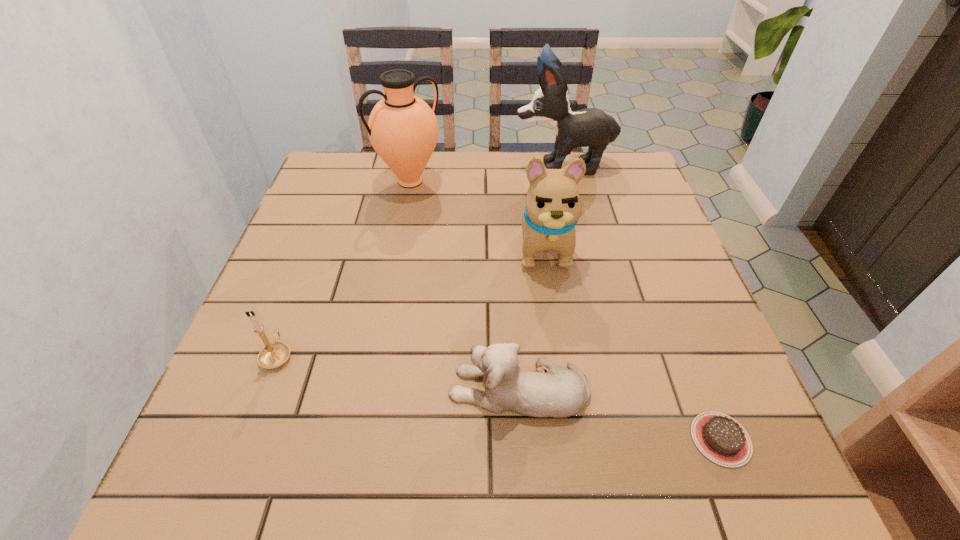
The image size is (960, 540). Identify the location of the tallest puppy. (591, 127).

The width and height of the screenshot is (960, 540). Find the location of `the second object from left to right`. the second object from left to right is located at coordinates (402, 128).

Identify the location of the second farthest puppy. This screenshot has width=960, height=540. (553, 206).

The width and height of the screenshot is (960, 540). In order to click on the second shortest puppy in this screenshot , I will do `click(553, 206)`.

Where is `candle holder`? candle holder is located at coordinates (273, 355).

You are a GUI agent. You are given a task and a screenshot of the screen. Output one action in this format:
    pyautogui.click(x=<x>, y=<y>)
    Task: Click on the shortest puppy
    
    Given the screenshot: What is the action you would take?
    pyautogui.click(x=561, y=392)

The width and height of the screenshot is (960, 540). I want to click on the shortest object, so click(720, 438).

Where is `free spot located 0.070m on the front-facing side of the tallest puppy`? Image resolution: width=960 pixels, height=540 pixels. free spot located 0.070m on the front-facing side of the tallest puppy is located at coordinates (490, 166).

Where is `blank area located on the front-facing side of the tallest puppy`? This screenshot has height=540, width=960. blank area located on the front-facing side of the tallest puppy is located at coordinates (455, 166).

The width and height of the screenshot is (960, 540). I want to click on vacant area situated on the front-facing side of the tallest puppy, so click(435, 166).